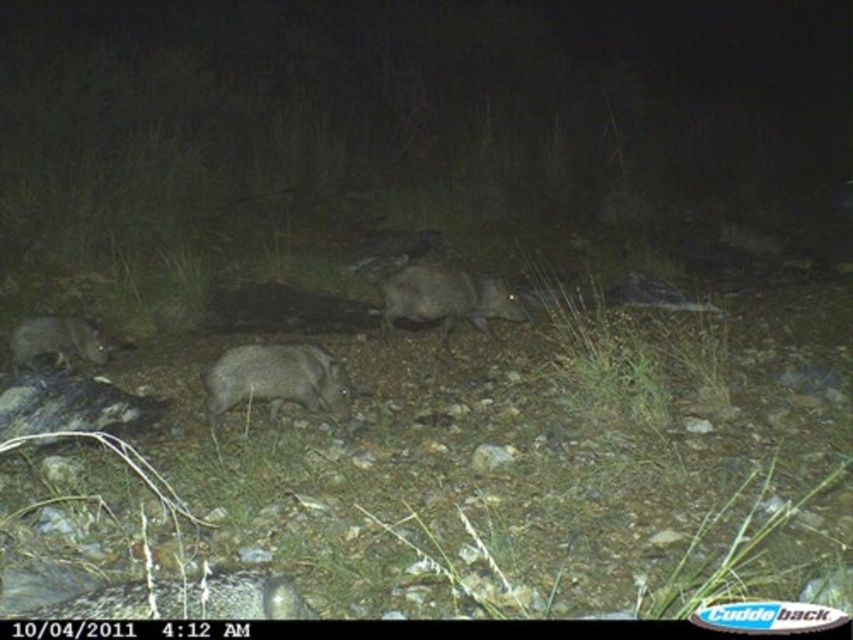
Is gray fur animal at center positioned at the back of gray furry boar at center?

No.

The image size is (853, 640). Describe the element at coordinates (189, 598) in the screenshot. I see `gray fur animal at center` at that location.

Is point (74, 612) positioned in front of point (218, 385)?

Yes.

Identify the location of gray fur animal at center. (189, 598).

Which is behind, point (126, 592) or point (430, 273)?

The point (430, 273) is more distant.

What do you see at coordinates (189, 598) in the screenshot?
I see `gray fur animal at center` at bounding box center [189, 598].

Describe the element at coordinates (189, 598) in the screenshot. I see `gray fur animal at center` at that location.

Find the location of `gray fur animal at center`. gray fur animal at center is located at coordinates (189, 598).

Who is lower down, gray matte boar at center or gray fur animal at lower left?

Positioned lower is gray fur animal at lower left.

Consider the image. Can you confirm if gray matte boar at center is bigger than gray fur animal at lower left?

Yes.

What do you see at coordinates (445, 298) in the screenshot? I see `gray matte boar at center` at bounding box center [445, 298].

Find the location of `gray matte boar at center`. gray matte boar at center is located at coordinates (445, 298).